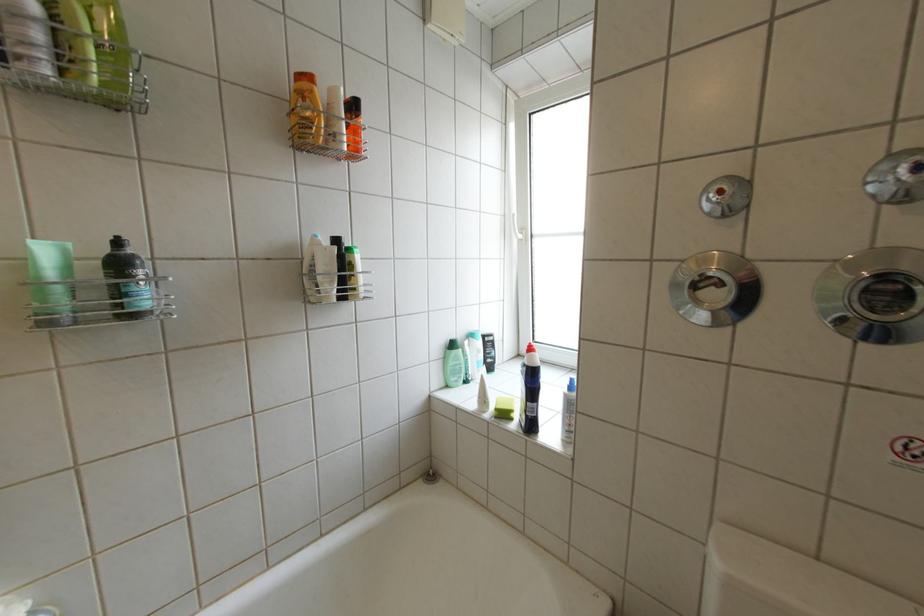
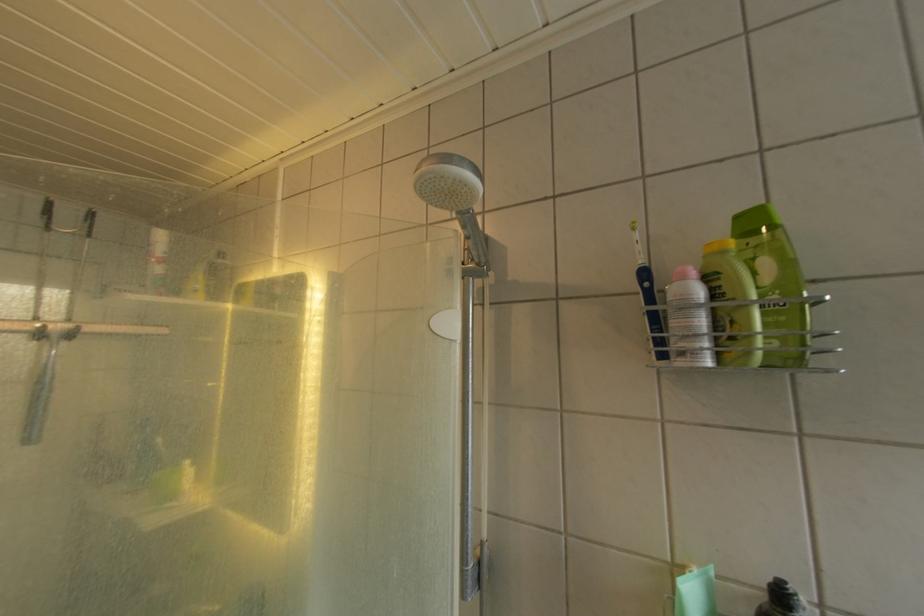
Locate, in the second image, the point that corresponds to (57,59) in the first image.

(719, 345)